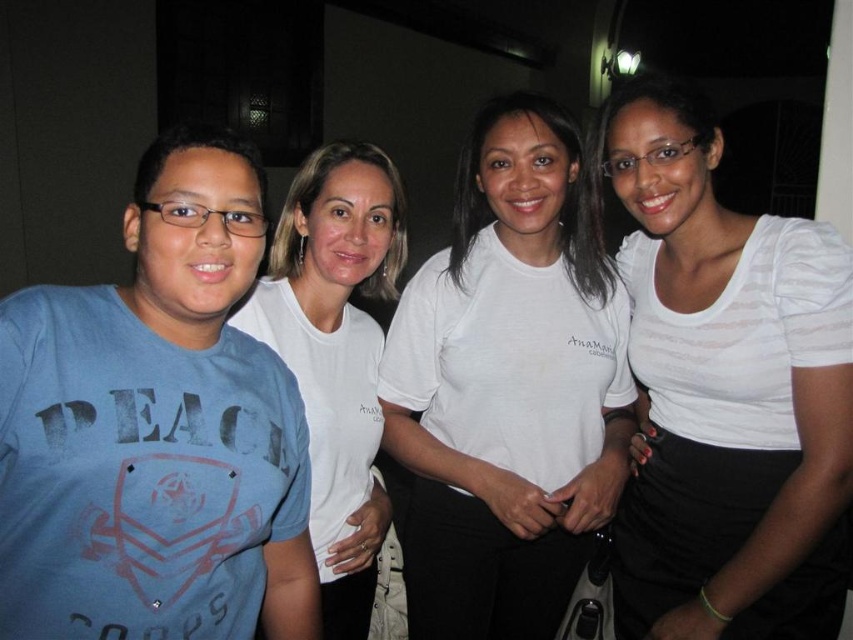
Is point (312, 634) positioned before point (412, 525)?

Yes, it is in front of point (412, 525).

Does blue matte t-shirt at left appear over white cotton shirt at center?

Yes, blue matte t-shirt at left is above white cotton shirt at center.

Does point (26, 429) come in front of point (589, 243)?

Yes, point (26, 429) is closer to viewer.

The height and width of the screenshot is (640, 853). Find the location of `blue matte t-shirt at left`. blue matte t-shirt at left is located at coordinates (155, 429).

Can you confirm if blue matte t-shirt at left is taller than white textured shirt at center?

No.

Who is more distant from viewer, (206, 582) or (764, 296)?

The point (764, 296) is more distant.

Identify the location of blue matte t-shirt at left. This screenshot has width=853, height=640. [155, 429].

Find the location of a particular element. blue matte t-shirt at left is located at coordinates (155, 429).

Looking at this image, does white cotton shirt at center have a larger size compared to white cotton t-shirt at center?

Indeed, white cotton shirt at center has a larger size compared to white cotton t-shirt at center.

Does white cotton shirt at center lie behind white cotton t-shirt at center?

Yes, it is behind white cotton t-shirt at center.

In order to click on white cotton shirt at center in this screenshot , I will do `click(508, 385)`.